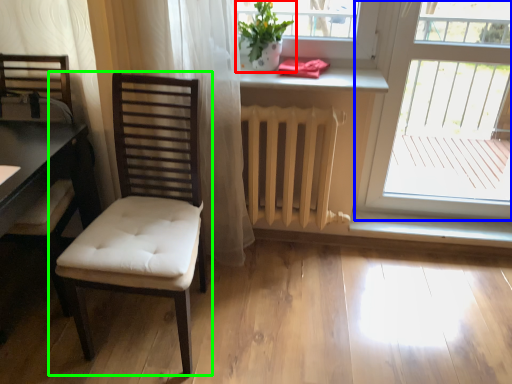
Question: Which object is the farthest from houseplant (highlighted by a red box)? Choose among these: window (highlighted by a blue box) or chair (highlighted by a green box).

Choices:
 (A) window
 (B) chair

Answer: (A)